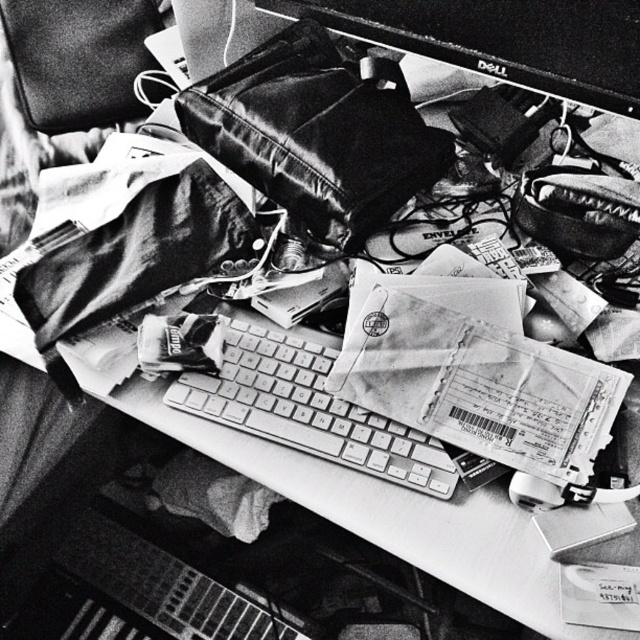
Question: Among these points, which one is farthest from the camera?

Choices:
 (A) (356, 429)
 (B) (400, 93)

Answer: (B)

Question: Observing the image, what is the correct spatial positioning of leather bag at center in reference to metallic keyboard at center?

Choices:
 (A) below
 (B) above

Answer: (B)

Question: Which point is closer to the camera?

Choices:
 (A) metallic keyboard at center
 (B) leather bag at center

Answer: (A)

Question: Can you confirm if leather bag at center is thinner than metallic keyboard at center?

Choices:
 (A) no
 (B) yes

Answer: (A)

Question: Is leather bag at center positioned behind metallic keyboard at center?

Choices:
 (A) no
 (B) yes

Answer: (B)

Question: Which object appears farthest from the camera in this image?

Choices:
 (A) metallic keyboard at center
 (B) leather bag at center

Answer: (B)